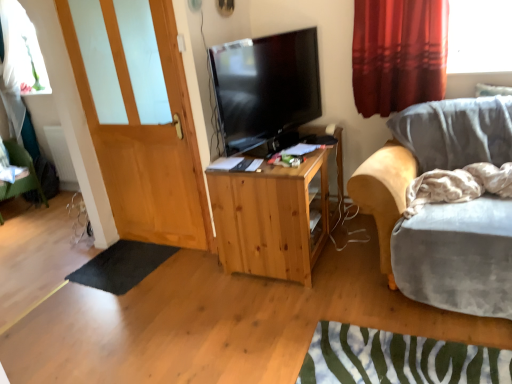
This screenshot has height=384, width=512. I want to click on vacant space to the left of velvet grey chair at right, so click(301, 313).